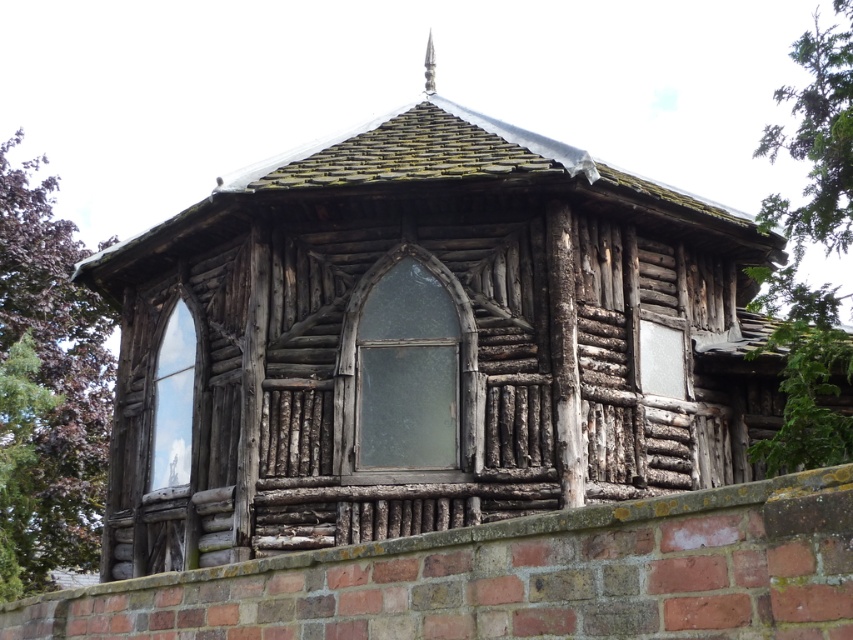
Question: Which object is the closest to the green leafy tree at upper right?

Choices:
 (A) translucent glass window at center
 (B) purple leafy tree at left

Answer: (A)

Question: Which of the following is the closest to the observer?

Choices:
 (A) (180, 381)
 (B) (15, 444)
 (C) (422, 353)
 (D) (811, 296)

Answer: (D)

Question: Is green leafy tree at upper right bigger than clear glass window at left?

Choices:
 (A) yes
 (B) no

Answer: (A)

Question: Which of the following is the closest to the observer?

Choices:
 (A) (776, 342)
 (B) (149, 468)
 (C) (415, 355)

Answer: (A)

Question: Can you confirm if purple leafy tree at left is positioned above green leafy tree at upper right?

Choices:
 (A) no
 (B) yes

Answer: (A)

Question: Is green leafy tree at upper right positioned at the back of clear glass window at left?

Choices:
 (A) yes
 (B) no

Answer: (B)